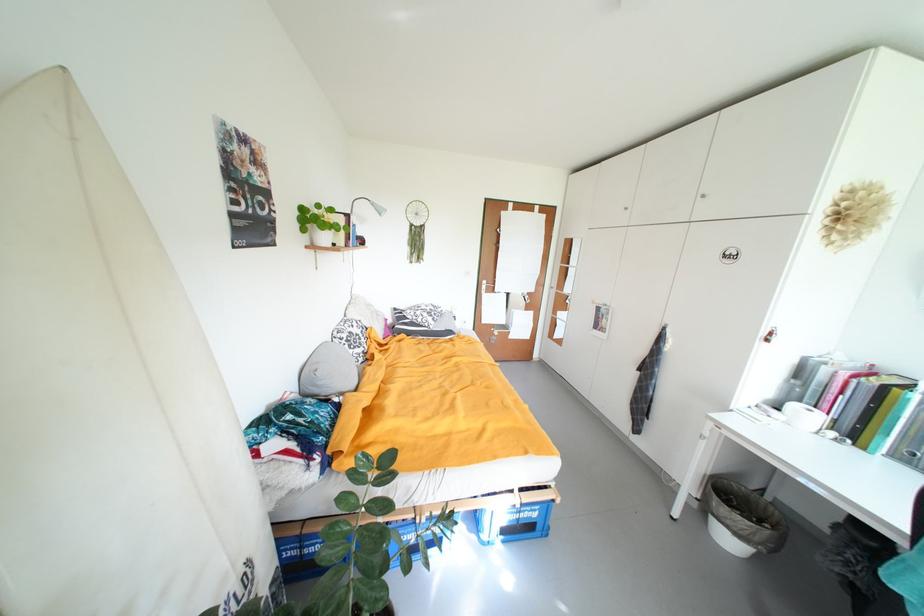
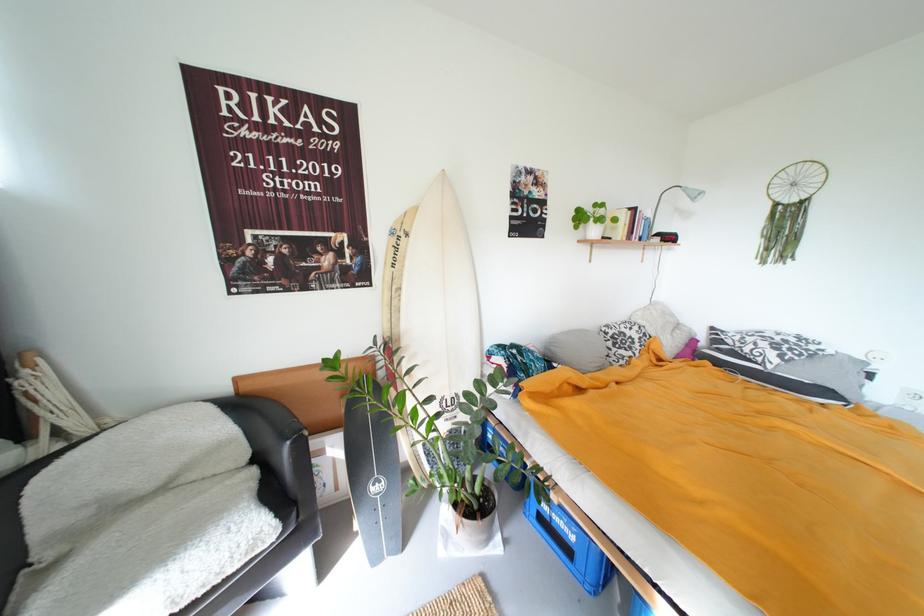
In the second image, find the point that corresponds to the point at 326,385 in the first image.

(560, 350)